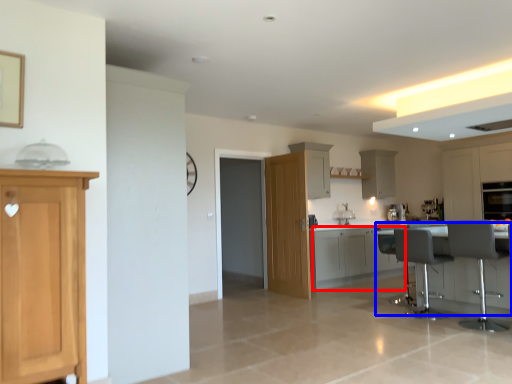
Question: Among these objects, which one is nearest to the camera, cabinetry (highlighted by a red box) or table (highlighted by a blue box)?

Choices:
 (A) cabinetry
 (B) table

Answer: (B)